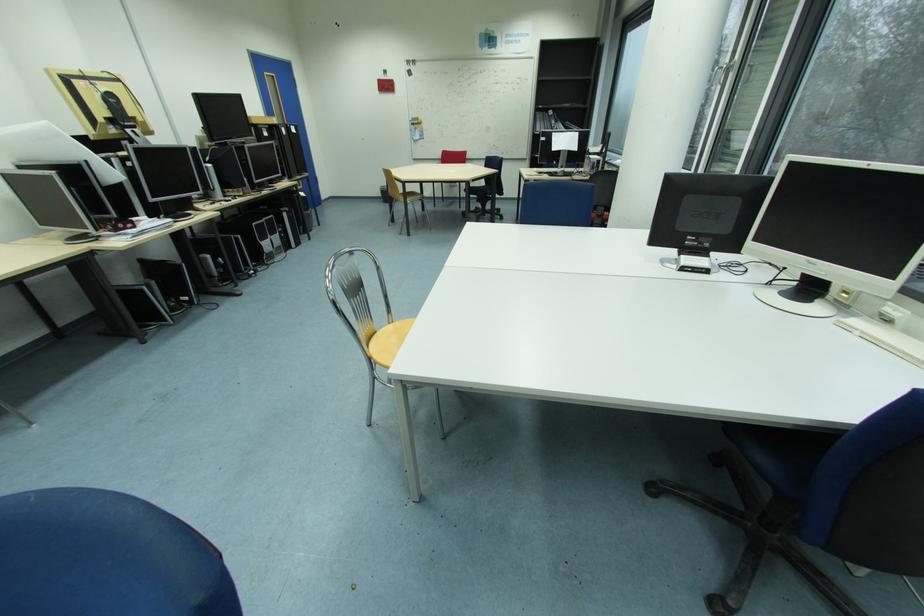
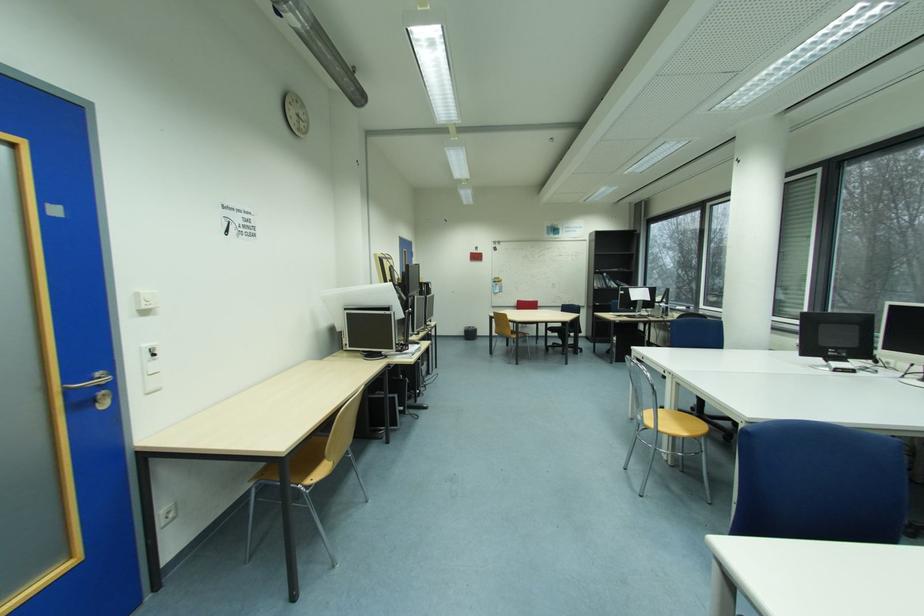
Which direction would the cameraman need to move to produce the second image?

The movement direction of the cameraman is left, backward.